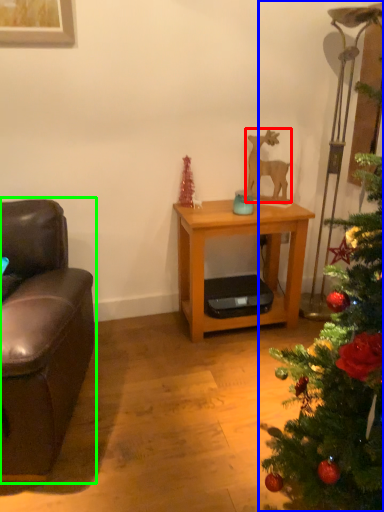
Question: Based on their relative distances, which object is farther from animal (highlighted by a red box)? Choose from christmas tree (highlighted by a blue box) and studio couch (highlighted by a green box).

Choices:
 (A) christmas tree
 (B) studio couch

Answer: (B)